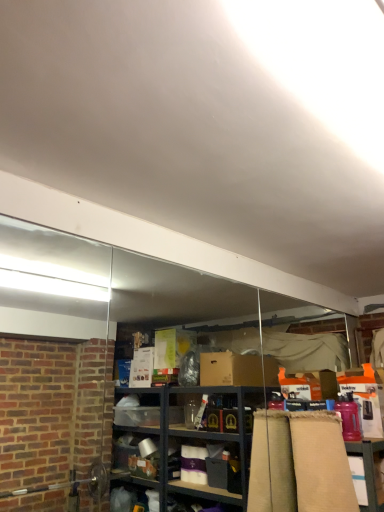
Question: Is the surface of beige fabric at right in direct contact with matte cardboard table at lower right?

Choices:
 (A) no
 (B) yes

Answer: (A)

Question: Is beige fabric at right at the left side of matte cardboard table at lower right?

Choices:
 (A) no
 (B) yes

Answer: (B)

Question: Considering the relative positions of beige fabric at right and matte cardboard table at lower right in the image provided, is beige fabric at right behind matte cardboard table at lower right?

Choices:
 (A) yes
 (B) no

Answer: (B)

Question: Is beige fabric at right smaller than matte cardboard table at lower right?

Choices:
 (A) yes
 (B) no

Answer: (B)

Question: Is beige fabric at right in front of matte cardboard table at lower right?

Choices:
 (A) yes
 (B) no

Answer: (A)

Question: From a real-world perspective, is beige fabric at right located higher than matte cardboard table at lower right?

Choices:
 (A) yes
 (B) no

Answer: (A)

Question: From the image's perspective, is matte cardboard table at lower right located above beige fabric at right?

Choices:
 (A) no
 (B) yes

Answer: (A)

Question: Considering the relative positions of matte cardboard table at lower right and beige fabric at right in the image provided, is matte cardboard table at lower right behind beige fabric at right?

Choices:
 (A) yes
 (B) no

Answer: (A)

Question: Is matte cardboard table at lower right with beige fabric at right?

Choices:
 (A) yes
 (B) no

Answer: (B)

Question: Is matte cardboard table at lower right thinner than beige fabric at right?

Choices:
 (A) no
 (B) yes

Answer: (B)

Question: Is beige fabric at right surrounded by matte cardboard table at lower right?

Choices:
 (A) no
 (B) yes

Answer: (A)

Question: Considering the relative sizes of matte cardboard table at lower right and beige fabric at right in the image provided, is matte cardboard table at lower right wider than beige fabric at right?

Choices:
 (A) no
 (B) yes

Answer: (A)

Question: From the image's perspective, is beige fabric at right above or below matte cardboard table at lower right?

Choices:
 (A) above
 (B) below

Answer: (A)